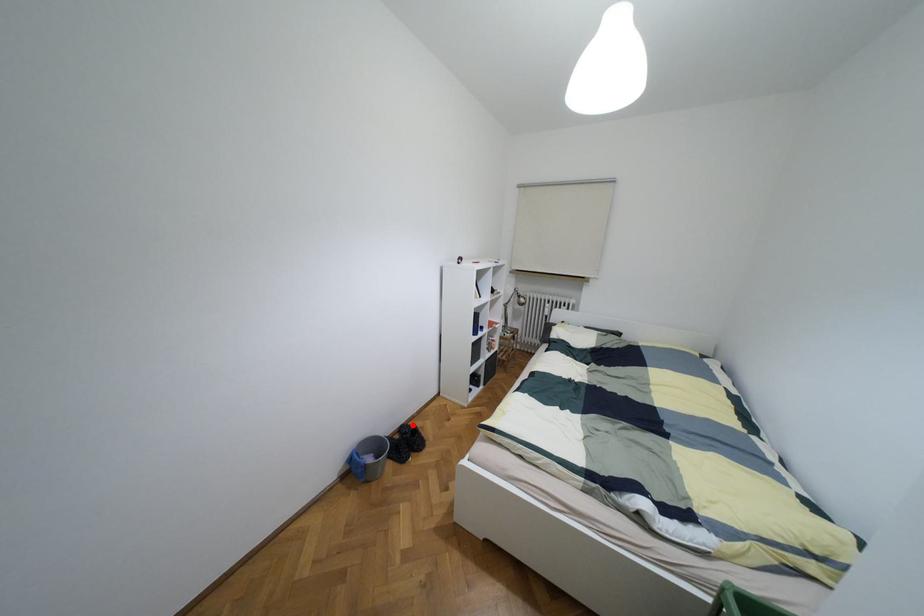
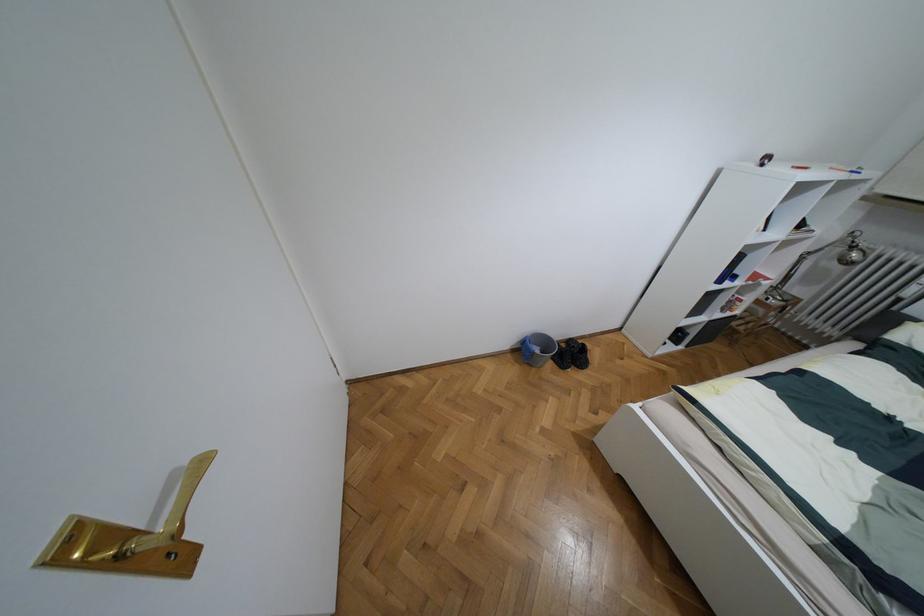
Where in the second image is the point corresponding to the highlighted location from the first image?

(582, 344)